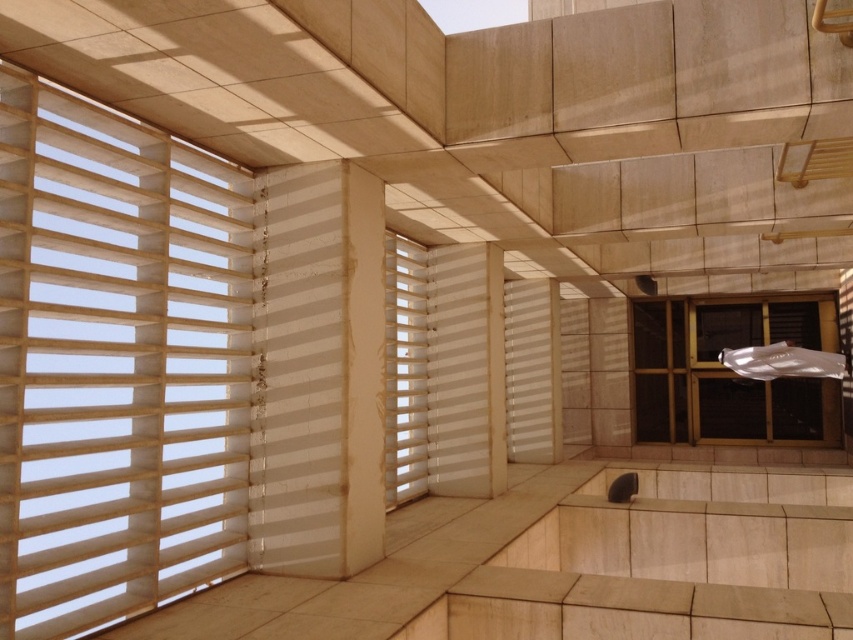
Question: Is white matte blinds at left above white matte window at center?

Choices:
 (A) no
 (B) yes

Answer: (B)

Question: Which object is closer to the camera taking this photo?

Choices:
 (A) matte black window at right
 (B) white matte blinds at left

Answer: (B)

Question: Estimate the real-world distances between objects in this image. Which object is closer to the white matte blinds at left?

Choices:
 (A) matte black window at right
 (B) white matte window at center

Answer: (B)

Question: Is matte black window at right further to the viewer compared to white matte window at center?

Choices:
 (A) yes
 (B) no

Answer: (A)

Question: Which point is farther from the camera taking this photo?

Choices:
 (A) (737, 435)
 (B) (68, 532)
 (C) (386, 317)

Answer: (A)

Question: Is white matte blinds at left positioned before white matte window at center?

Choices:
 (A) no
 (B) yes

Answer: (B)